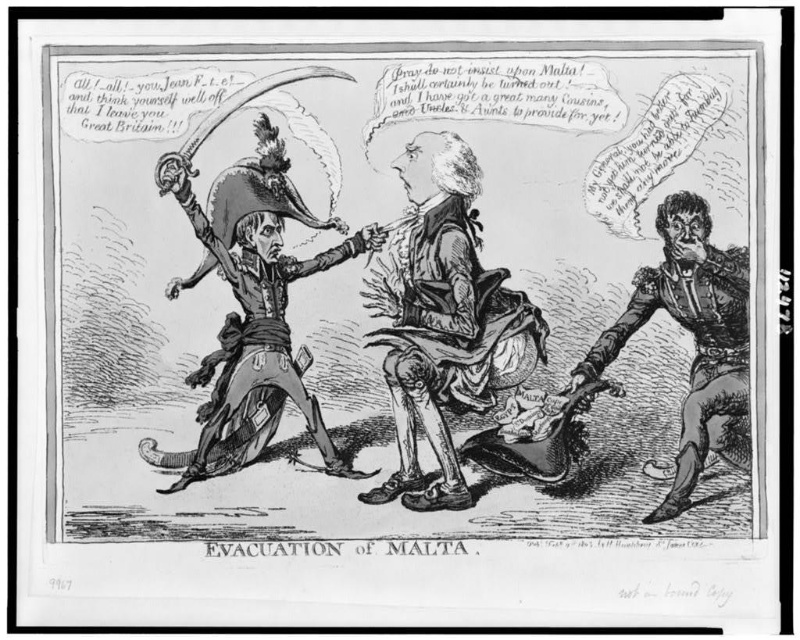
Is shiny black sword at center positioned in front of smooth leather glove at right?

That is True.

Can you confirm if shiny black sword at center is positioned to the right of smooth leather glove at right?

In fact, shiny black sword at center is to the left of smooth leather glove at right.

This screenshot has height=640, width=800. In order to click on shiny black sword at center in this screenshot , I will do `click(444, 320)`.

Does shiny black sword at center have a lesser height compared to brushed metal sword at left?

Incorrect, shiny black sword at center's height does not fall short of brushed metal sword at left's.

Does shiny black sword at center have a larger size compared to brushed metal sword at left?

Actually, shiny black sword at center might be smaller than brushed metal sword at left.

Who is more distant from viewer, [476,355] or [262,230]?

Positioned behind is point [476,355].

Image resolution: width=800 pixels, height=640 pixels. In order to click on shiny black sword at center in this screenshot , I will do click(444, 320).

Who is lower down, brushed metal sword at left or smooth leather glove at right?

smooth leather glove at right

This screenshot has width=800, height=640. What do you see at coordinates (252, 308) in the screenshot? I see `brushed metal sword at left` at bounding box center [252, 308].

You are a GUI agent. You are given a task and a screenshot of the screen. Output one action in this format:
    pyautogui.click(x=<x>, y=<y>)
    Task: Click on the brushed metal sword at left
    This screenshot has width=800, height=640.
    Given the screenshot: What is the action you would take?
    pyautogui.click(x=252, y=308)